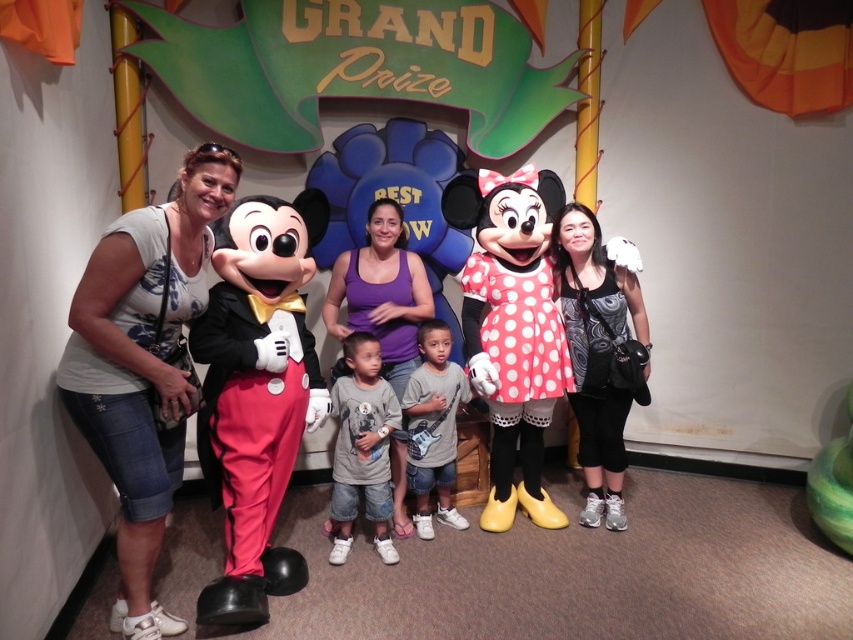
You are standing at the position of the point at coordinates point (223, 614) and want to walk towards the point at coordinates point (381, 454). Based on the scene description, will you need to move forward or backward to reach it?

Since point (223, 614) is in front of point (381, 454), you would need to move backward to reach the latter point from your current position.